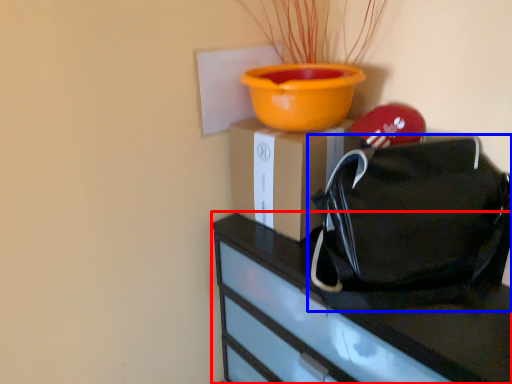
Question: Which object is further to the camera taking this photo, furniture (highlighted by a red box) or handbag (highlighted by a blue box)?

Choices:
 (A) furniture
 (B) handbag

Answer: (B)